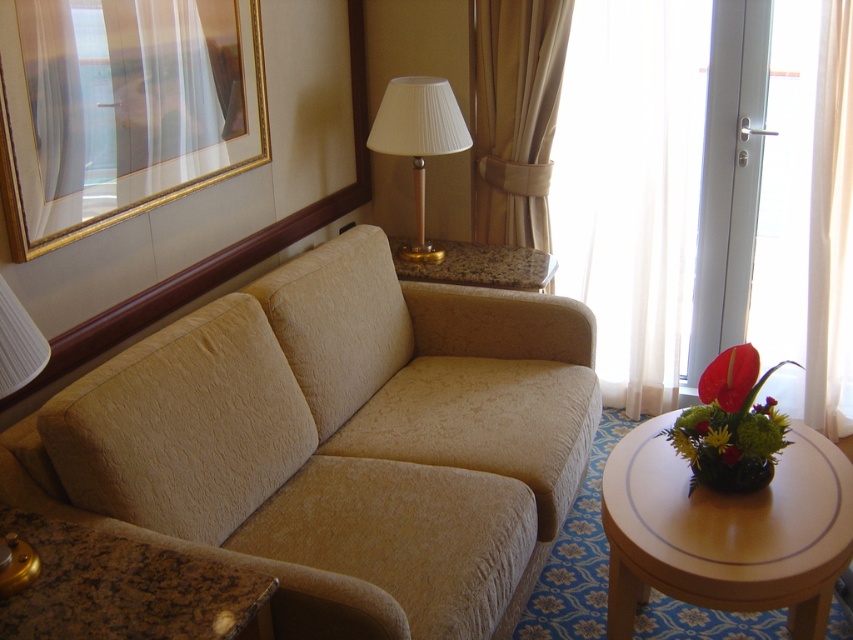
In the scene shown: You are standing in the room and want to move from point A to point B. If point A is at coordinates point (820, 102) and point B is at coordinates point (712, 433), which direction should you move to get from point A to point B?

To move from point A at coordinates point (820, 102) to point B at coordinates point (712, 433), you should move towards the right and slightly forward since point A is behind point B according to the spatial description.

You are a guest in this hotel room and want to know which object is taller between the white sheer curtain at right and the yellow matte flower at center. Can you tell me?

The white sheer curtain at right is taller than the yellow matte flower at center.

You are a guest in this hotel room and want to open the window to let in some fresh air. The window is behind the white sheer curtain at right. To reach the window, you need to move past the yellow matte flower at center. Based on their positions, which object should you move first to access the window?

You should move the yellow matte flower at center first because the white sheer curtain at right is to the right of the yellow matte flower at center, so moving the flower out of the way will allow you to access the window behind the curtain.